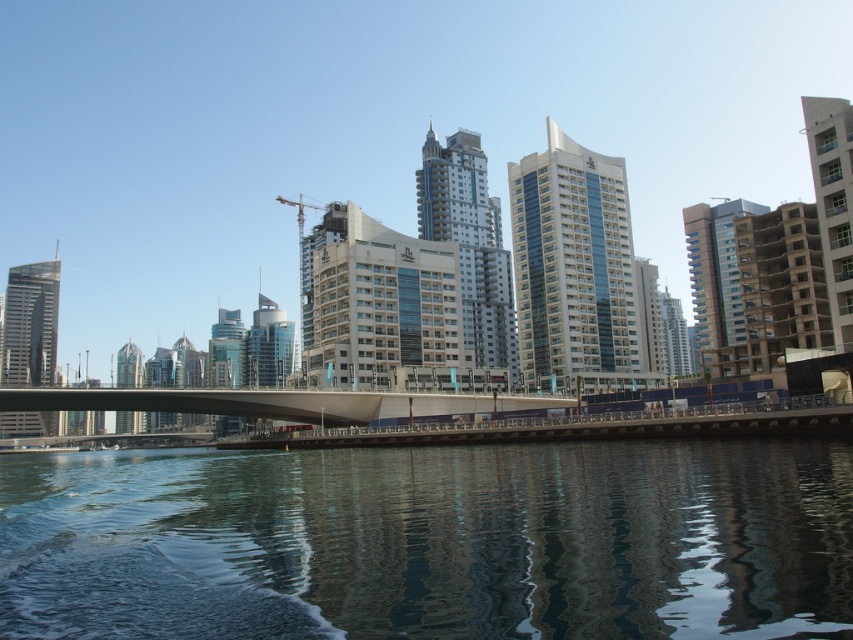
Question: Is metallic glass building at center to the right of white concrete building at right from the viewer's perspective?

Choices:
 (A) yes
 (B) no

Answer: (B)

Question: Which object is the closest to the white concrete building at right?

Choices:
 (A) metallic glass building at center
 (B) glassy blue skyscraper at left

Answer: (A)

Question: Which of the following is the farthest from the observer?

Choices:
 (A) white glossy bridge at center
 (B) glassy blue skyscraper at left

Answer: (B)

Question: Is the position of beige concrete building at right less distant than that of metallic construction crane at center?

Choices:
 (A) yes
 (B) no

Answer: (A)

Question: Based on their relative distances, which object is nearer to the transparent water at lower center?

Choices:
 (A) white glossy bridge at center
 (B) white concrete building at right
 (C) glassy blue skyscraper at center

Answer: (A)

Question: Does glassy blue skyscraper at center have a smaller size compared to glassy blue skyscraper at left?

Choices:
 (A) no
 (B) yes

Answer: (B)